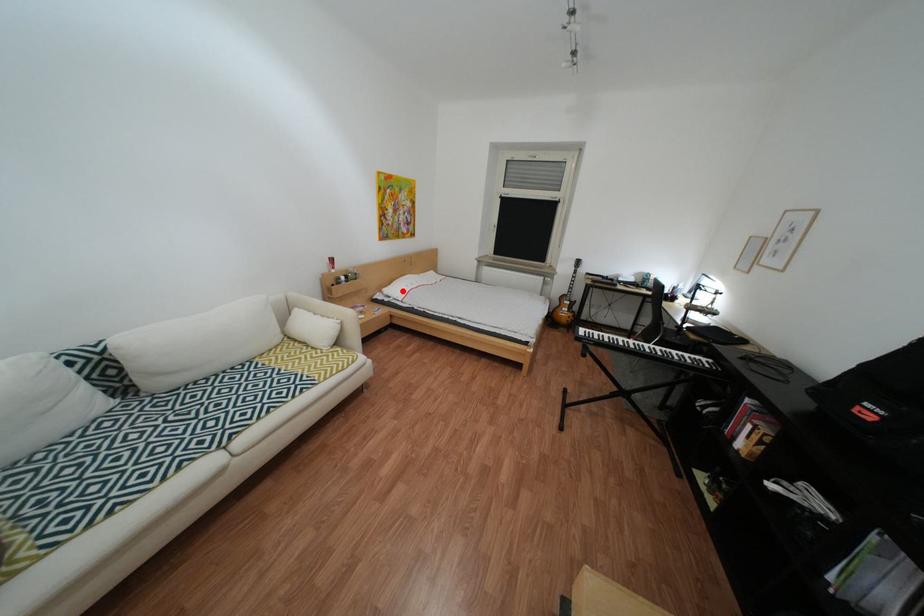
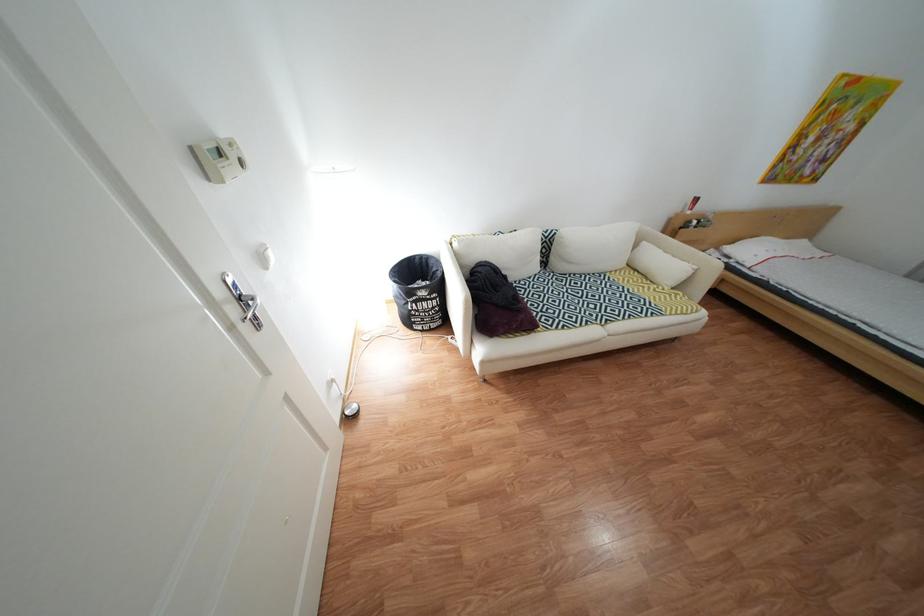
Where in the second image is the point corresponding to the highlighted location from the first image?

(744, 249)